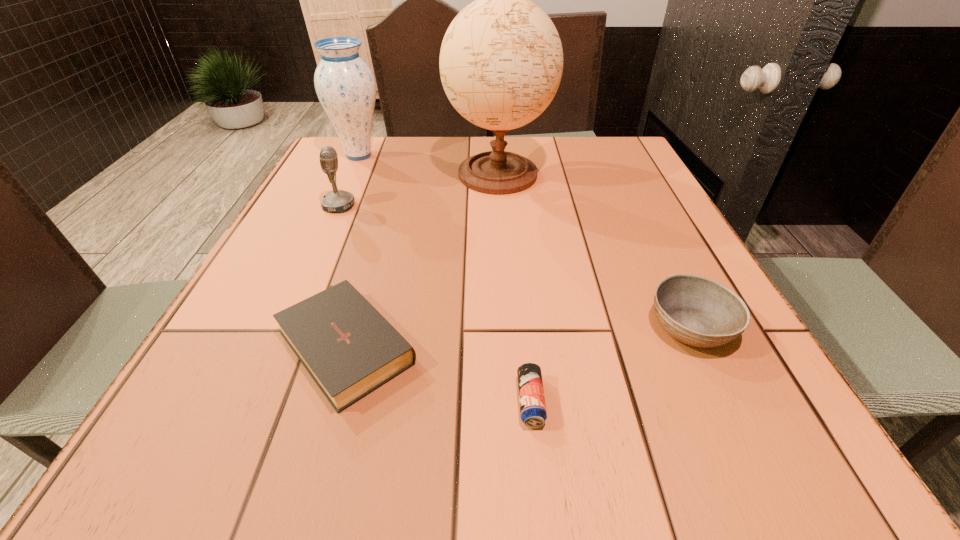
This screenshot has height=540, width=960. I want to click on free spot between the microphone and the fourth tallest object, so click(515, 266).

I want to click on unoccupied position between the Bible and the fifth shortest object, so click(353, 248).

Where is `free spot between the third tallest object and the beer can`? free spot between the third tallest object and the beer can is located at coordinates (435, 303).

Find the location of `free space between the Bible and the beer can`. free space between the Bible and the beer can is located at coordinates (440, 371).

Identify the location of empty space between the third tallest object and the fifth shortest object. (348, 180).

The width and height of the screenshot is (960, 540). I want to click on empty location between the microphone and the Bible, so click(344, 273).

Where is `vacant region between the tallest object and the third tallest object`? The width and height of the screenshot is (960, 540). vacant region between the tallest object and the third tallest object is located at coordinates (419, 190).

Where is `the third closest object to the Bible`? the third closest object to the Bible is located at coordinates (501, 60).

Image resolution: width=960 pixels, height=540 pixels. In order to click on object that is the fourth nearest to the shortest object in this screenshot , I will do `click(338, 201)`.

Find the location of a particular element. The width and height of the screenshot is (960, 540). free location that satisfies the following two spatial constraints: 1. on the back side of the Bible; 2. on the left side of the fourth tallest object is located at coordinates (352, 327).